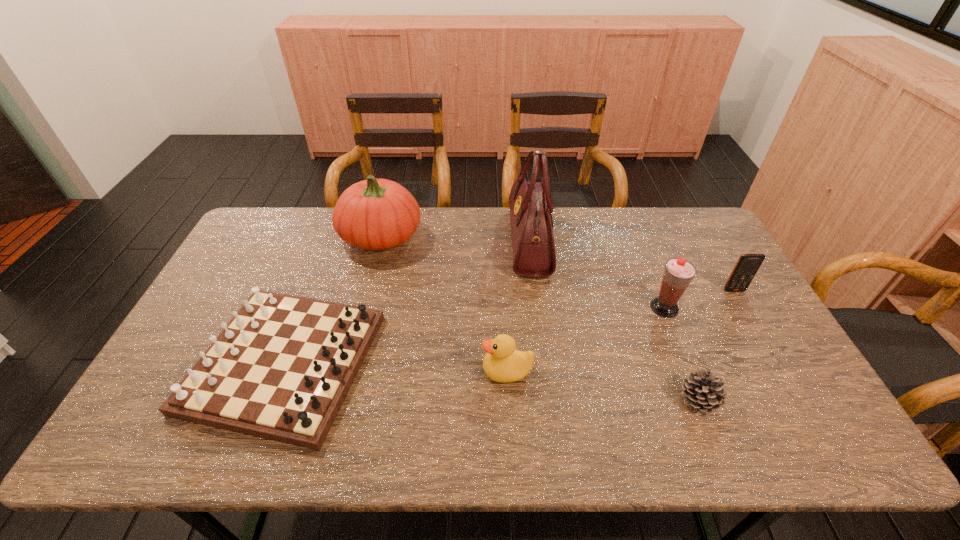
Locate an element on the screen. The height and width of the screenshot is (540, 960). vacant area located 0.370m on the front-facing side of the tallest object is located at coordinates (402, 242).

Where is `vacant region located 0.080m on the left of the pumpkin`? The height and width of the screenshot is (540, 960). vacant region located 0.080m on the left of the pumpkin is located at coordinates (317, 237).

You are a GUI agent. You are given a task and a screenshot of the screen. Output one action in this format:
    pyautogui.click(x=<x>, y=<y>)
    Task: Click on the vacant region located on the back of the smoothie
    The width and height of the screenshot is (960, 540).
    Given the screenshot: What is the action you would take?
    pyautogui.click(x=643, y=254)

Find the location of a particular element. This screenshot has width=960, height=540. free spot located 0.160m on the screen of the rightmost object is located at coordinates (759, 333).

Identify the location of vacant space positioned at the beak of the duck. Image resolution: width=960 pixels, height=540 pixels. (374, 371).

This screenshot has width=960, height=540. Identify the location of vacant space positioned at the beak of the duck. (355, 371).

The width and height of the screenshot is (960, 540). Identify the location of free space located at the beak of the duck. (455, 371).

The width and height of the screenshot is (960, 540). I want to click on free point located on the back of the pinecone, so click(x=663, y=312).

Find the location of `vacant space located on the back of the chessboard`. vacant space located on the back of the chessboard is located at coordinates (325, 258).

At what (x,y) coordinates should I click in order to perform the action: click on handbag that is at the far edge. Please return your answer as a coordinate pair (x, y). The width and height of the screenshot is (960, 540). Looking at the image, I should click on (530, 203).